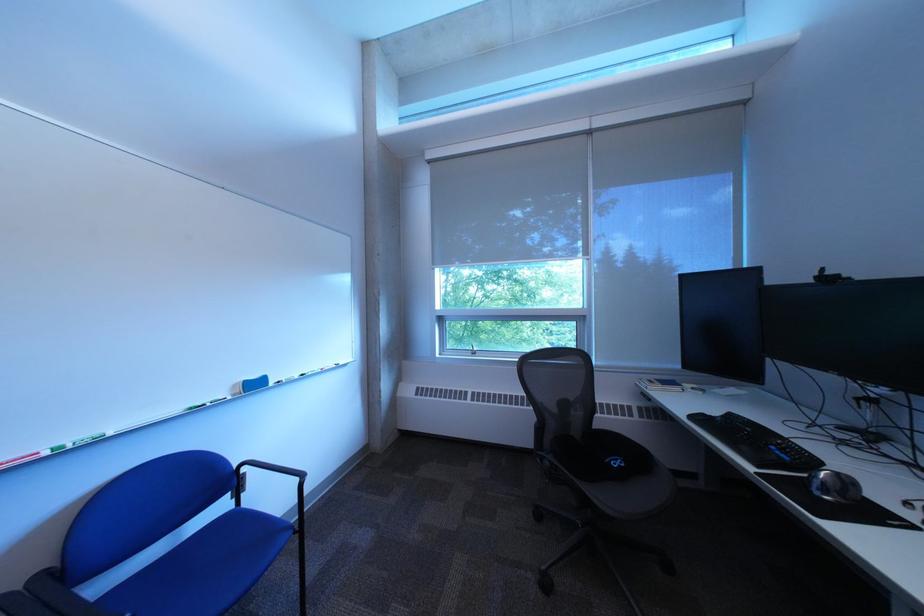
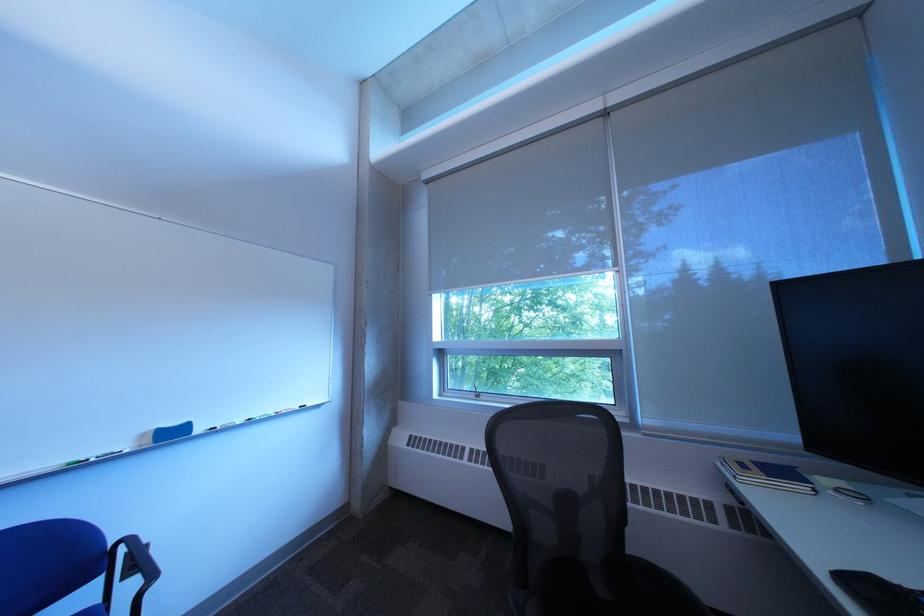
The point at (x=708, y=419) is marked in the first image. Where is the corresponding point in the second image?

(860, 582)